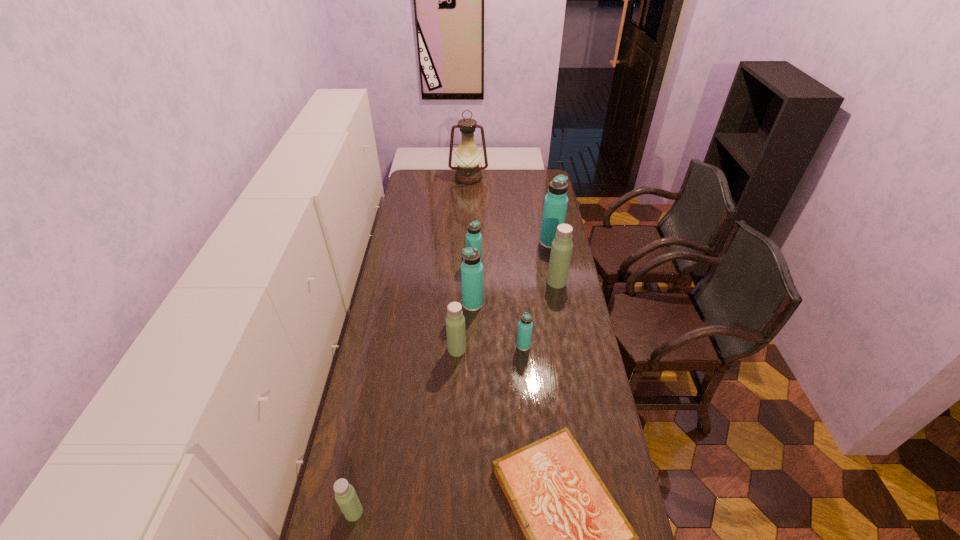
The image size is (960, 540). I want to click on the second nearest light thermos bottle, so click(455, 321).

The width and height of the screenshot is (960, 540). Find the location of `the smallest aqua thermos bottle`. the smallest aqua thermos bottle is located at coordinates pyautogui.click(x=525, y=326).

This screenshot has width=960, height=540. I want to click on the third aqua thermos bottle from left to right, so click(525, 326).

This screenshot has height=540, width=960. I want to click on the nearest thermos bottle, so click(345, 495).

The image size is (960, 540). What are the coordinates of `the smallest light thermos bottle` in the screenshot? It's located at (345, 495).

At what (x,y) coordinates should I click in order to perform the action: click on blank area located on the right of the oil lamp. Please return your answer as a coordinate pair (x, y). This screenshot has height=540, width=960. Looking at the image, I should click on (526, 178).

You are a GUI agent. You are given a task and a screenshot of the screen. Output one action in this format:
    pyautogui.click(x=<x>, y=<y>)
    Task: Click on the free space located on the front of the farthest aqua thermos bottle
    
    Given the screenshot: What is the action you would take?
    pyautogui.click(x=557, y=276)

Locate an element on the screen. vacant point located on the back of the second nearest aqua thermos bottle is located at coordinates [473, 252].

The image size is (960, 540). I want to click on vacant space located on the back of the rightmost light thermos bottle, so click(550, 246).

At what (x,y) coordinates should I click in order to perform the action: click on free region located 0.090m on the left of the third biggest aqua thermos bottle. Please return your answer as a coordinate pair (x, y). The width and height of the screenshot is (960, 540). Looking at the image, I should click on (447, 265).